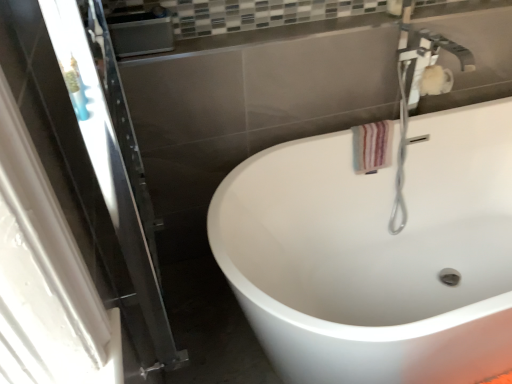
Question: Is striped fabric hand towel at upper right bigger or smaller than white glossy bathtub at center?

Choices:
 (A) small
 (B) big

Answer: (A)

Question: Is point (384, 130) closer or farther from the camera than point (465, 352)?

Choices:
 (A) farther
 (B) closer

Answer: (A)

Question: Estimate the real-world distances between objects in this image. Which object is closer to the white glossy bathtub at center?

Choices:
 (A) transparent glass screen door at left
 (B) white glossy faucet at upper right
 (C) striped fabric hand towel at upper right

Answer: (B)

Question: Which object is the farthest from the transparent glass screen door at left?

Choices:
 (A) striped fabric hand towel at upper right
 (B) white glossy faucet at upper right
 (C) white glossy bathtub at center

Answer: (B)